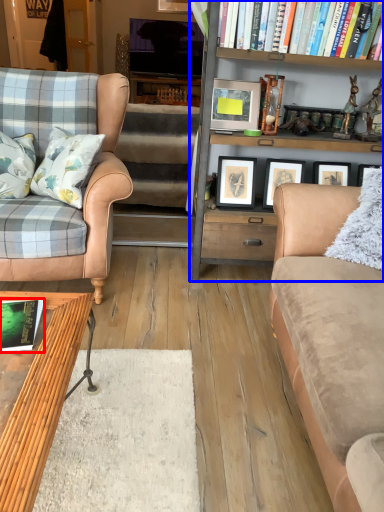
Question: Which object is closer to the camera taking this photo, book (highlighted by a red box) or bookcase (highlighted by a blue box)?

Choices:
 (A) book
 (B) bookcase

Answer: (A)